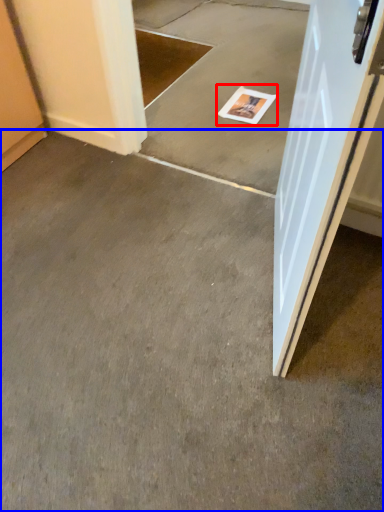
Question: Which object is closer to the camera taking this photo, magazine (highlighted by a red box) or concrete (highlighted by a blue box)?

Choices:
 (A) magazine
 (B) concrete

Answer: (B)